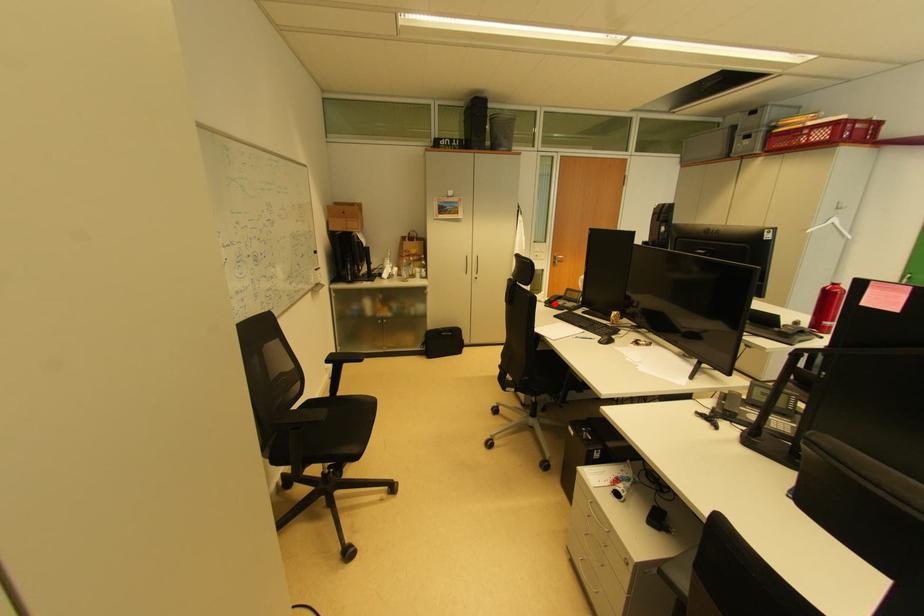
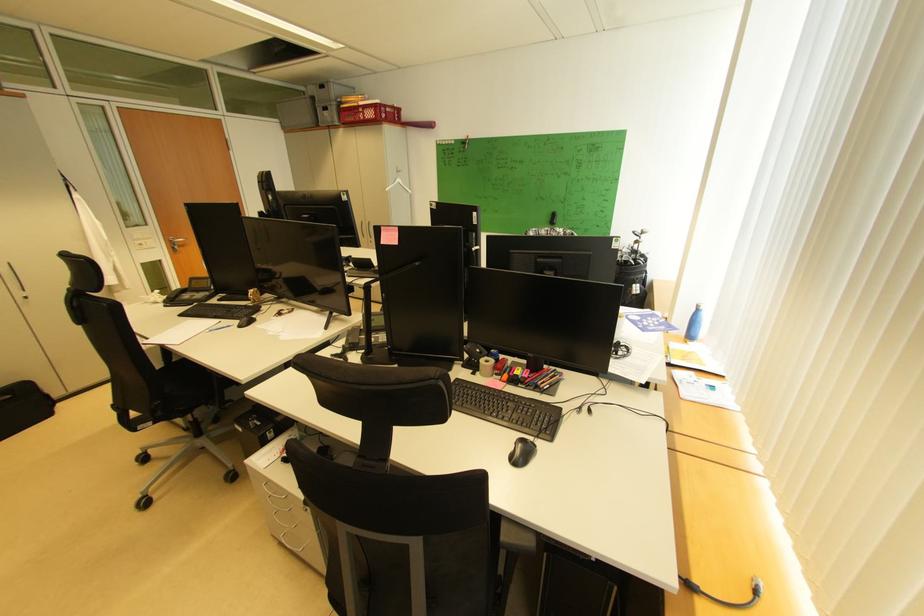
Question: I am providing you with two images of the same scene from different viewpoints. In image1, a red point is highlighted. Considering the same 3D point in image2, which of the following is correct?

Choices:
 (A) It is closer
 (B) It is farther

Answer: (A)